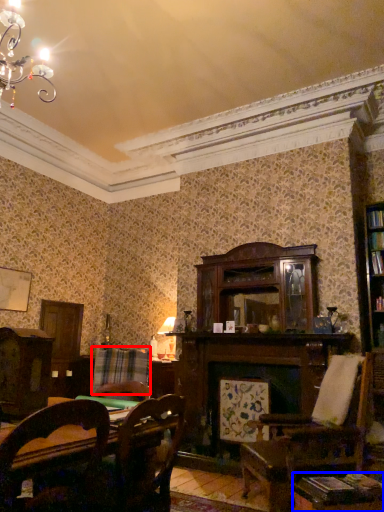
Question: Which point is closer to the camera, plaid (highlighted by a red box) or table (highlighted by a blue box)?

Choices:
 (A) plaid
 (B) table

Answer: (B)